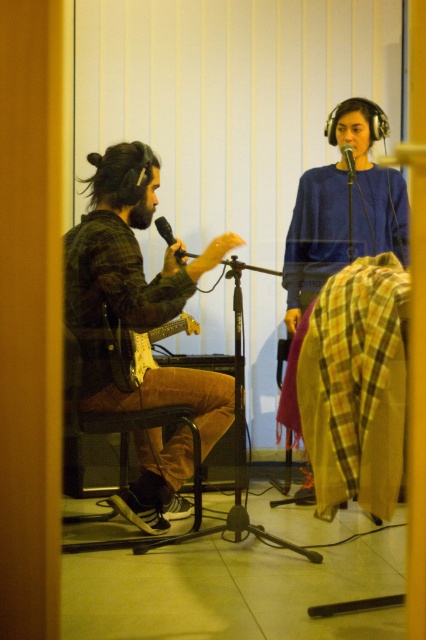
You are a photographer in the studio and want to capture a closeup of the black matte microphone at center while also including the blue cotton sweater at upper center in the frame. Which object should you position to the right side of the microphone to include both in the shot?

The blue cotton sweater at upper center is positioned on the right side of black matte microphone at center, so you should position the blue cotton sweater at upper center to the right side of the microphone to include both in the shot.

You are a sound engineer in a recording studio. You need to adjust the microphone stand so that the black matte microphone at center is positioned closer to the brown leather chair at left. Is the microphone currently positioned to the left or right of the chair?

The black matte microphone at center is currently positioned to the right of the brown leather chair at left, so you need to move it to the left to bring it closer.